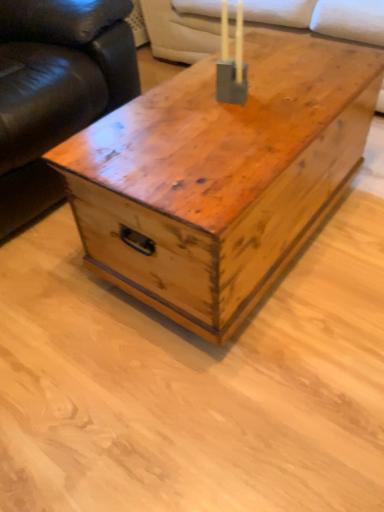
The height and width of the screenshot is (512, 384). In order to click on free location in front of matte gray concrete candle holder at center in this screenshot , I will do pyautogui.click(x=240, y=127).